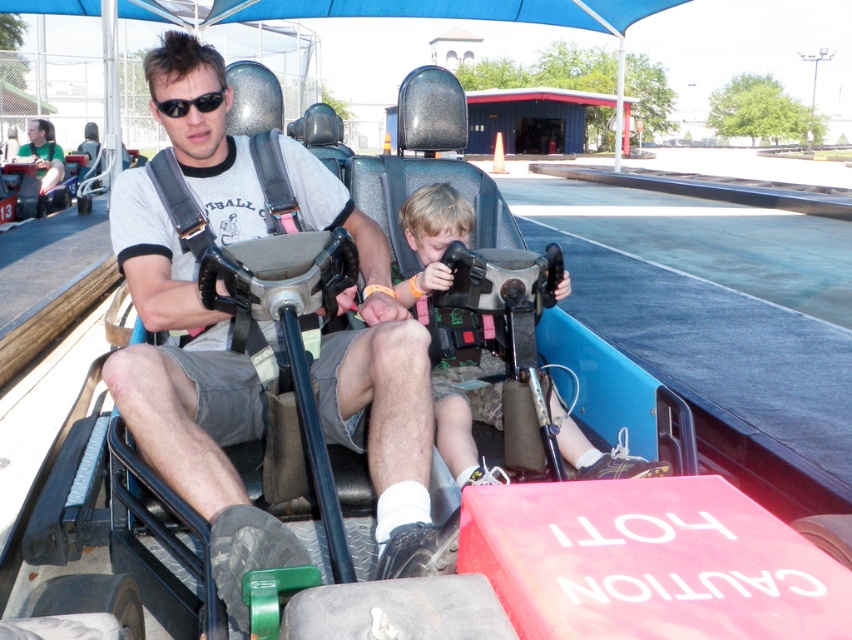
You are a safety inspector checking the seating arrangement of the go kart. According to the safety manual, the steering wheel must be positioned above the driver to ensure proper control. Are the positions of the matte gray steering wheel at center and the camouflage shorts at center compliant with this requirement?

Yes, the matte gray steering wheel at center is positioned above the camouflage shorts at center, which aligns with the safety manual requirement for proper control.

You are a safety inspector checking the go kart for proper harness installation. You have two points marked on the harness system. The first point is at coordinate point (427, 458) and the second point is at coordinate point (653, 467). Which of these points is closer to the camera?

Point (427, 458) is closer to the camera than point (653, 467).

You are a safety inspector checking the go kart for compliance. You need to ensure that the steering wheel is not obstructed by any objects. Based on the image, does the black matte sunglasses at upper center block the matte gray steering wheel at center?

The matte gray steering wheel at center is bigger than the black matte sunglasses at upper center. Since the sunglasses are smaller and positioned at upper center, they do not obstruct the steering wheel.